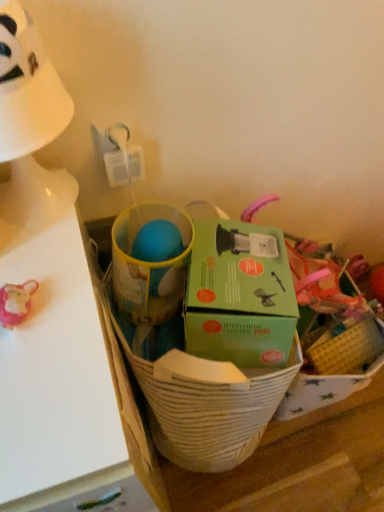
Question: From a real-world perspective, is green cardboard box at center positioned above or below white plastic table lamp at upper left?

Choices:
 (A) below
 (B) above

Answer: (A)

Question: In the image, is green cardboard box at center positioned in front of or behind white plastic table lamp at upper left?

Choices:
 (A) behind
 (B) front

Answer: (A)

Question: Which object is positioned closest to the green cardboard box at center?

Choices:
 (A) white matte table at left
 (B) green cardboard box at center
 (C) white plastic table lamp at upper left

Answer: (B)

Question: Which is nearer to the green cardboard box at center?

Choices:
 (A) white plastic table lamp at upper left
 (B) green cardboard box at center
 (C) white matte table at left

Answer: (B)